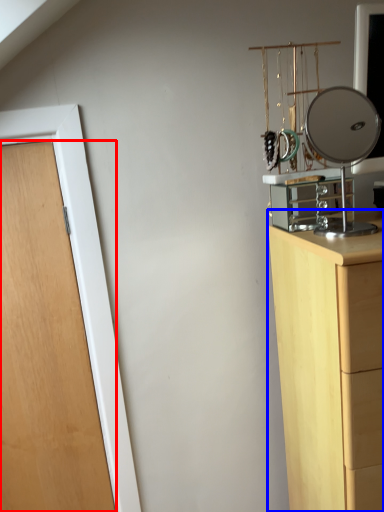
Question: Which point is further to the camera, door (highlighted by a red box) or chest of drawers (highlighted by a blue box)?

Choices:
 (A) door
 (B) chest of drawers

Answer: (A)